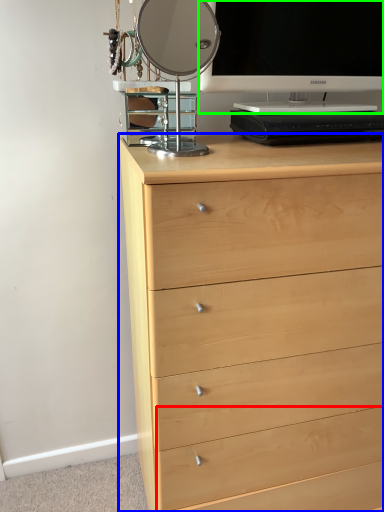
Question: Estimate the real-world distances between objects in this image. Which object is farther from drawer (highlighted by a red box), chest of drawers (highlighted by a blue box) or television (highlighted by a green box)?

Choices:
 (A) chest of drawers
 (B) television

Answer: (B)